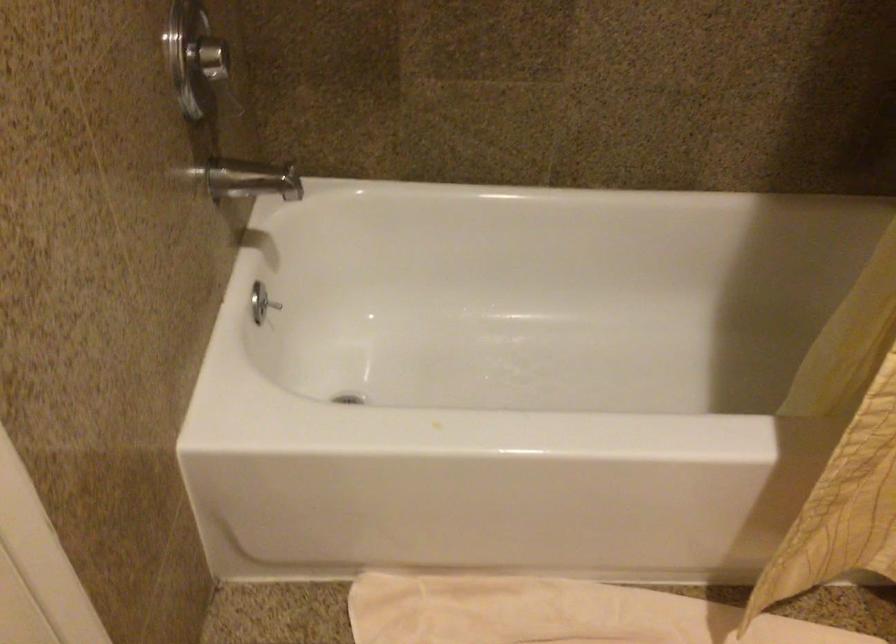
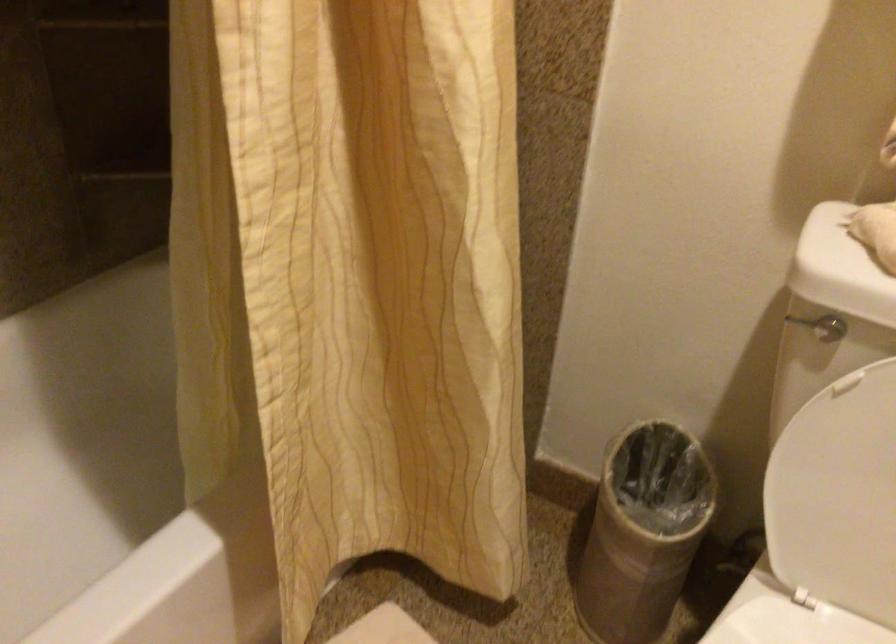
Question: The camera is either moving clockwise (left) or counter-clockwise (right) around the object. The first image is from the beginning of the video and the second image is from the end. Is the camera moving left or right when shooting the video?

Choices:
 (A) Left
 (B) Right

Answer: (A)